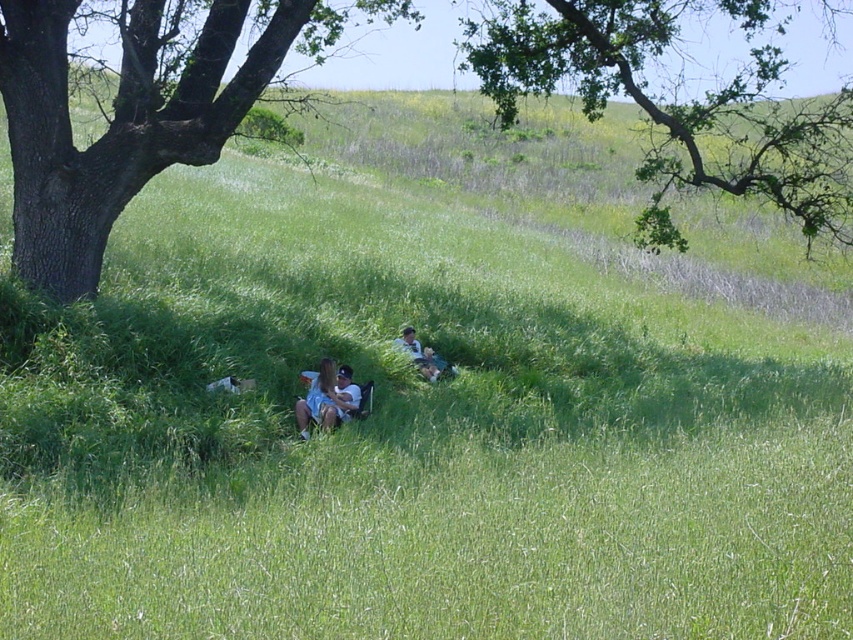
Question: Considering the relative positions of brown rough bark tree at left and light blue denim shorts at center in the image provided, where is brown rough bark tree at left located with respect to light blue denim shorts at center?

Choices:
 (A) right
 (B) left

Answer: (B)

Question: Can you confirm if brown rough tree at left is positioned to the right of denim shorts at lower center?

Choices:
 (A) yes
 (B) no

Answer: (B)

Question: Which point appears closest to the camera in this image?

Choices:
 (A) (434, 369)
 (B) (306, 396)

Answer: (B)

Question: Can you confirm if green leafy tree at upper center is positioned to the left of light blue denim shorts at center?

Choices:
 (A) no
 (B) yes

Answer: (A)

Question: Among these points, which one is farthest from the camera?

Choices:
 (A) (13, 177)
 (B) (311, 388)
 (C) (38, 138)
 (D) (416, 360)

Answer: (D)

Question: Which is farther from the brown rough tree at left?

Choices:
 (A) brown rough bark tree at left
 (B) green leafy tree at upper center

Answer: (A)